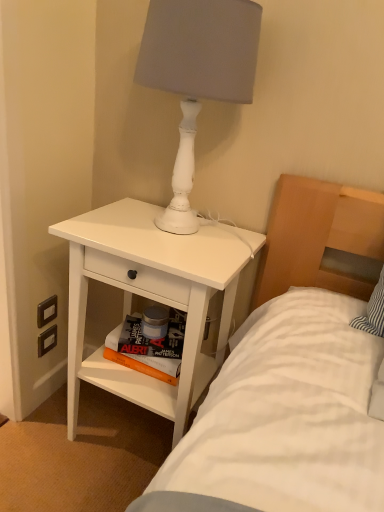
Identify the location of matte white switch at lower left, marked as the 2th electric outlet in a bottom-to-top arrangement. This screenshot has width=384, height=512. (46, 311).

Where is `black plastic electric outlet at lower left, the 1th electric outlet from the bottom`? black plastic electric outlet at lower left, the 1th electric outlet from the bottom is located at coordinates (47, 340).

Image resolution: width=384 pixels, height=512 pixels. In order to click on white matte nightstand at lower left in this screenshot , I will do (x=150, y=297).

In order to face orange matte book at lower center, the first magazine in the bottom-to-top sequence, should I rotate leftwards or rightwards?

You should rotate left by 6.099 degrees.

I want to click on matte white switch at lower left, the first electric outlet viewed from the top, so click(x=46, y=311).

Is hardcover book at lower center, which is counted as the first magazine, starting from the top, wider than matte white switch at lower left, marked as the 2th electric outlet in a bottom-to-top arrangement?

Correct, the width of hardcover book at lower center, which is counted as the first magazine, starting from the top, exceeds that of matte white switch at lower left, marked as the 2th electric outlet in a bottom-to-top arrangement.

Which electric outlet is the 1st one when counting from the left side of the hardcover book at lower center, which is counted as the first magazine, starting from the top? Please provide its 2D coordinates.

[(46, 311)]

Does point (154, 350) appear closer or farther from the camera than point (47, 308)?

Point (154, 350) is closer to the camera than point (47, 308).

This screenshot has height=512, width=384. I want to click on lamp above the orange matte book at lower center, the first magazine in the bottom-to-top sequence (from a real-world perspective), so click(x=197, y=74).

Who is bigger, orange matte book at lower center, the first magazine in the bottom-to-top sequence, or white matte lamp at upper right?

white matte lamp at upper right.

Is orange matte book at lower center, the first magazine in the bottom-to-top sequence, in front of or behind white matte lamp at upper right in the image?

orange matte book at lower center, the first magazine in the bottom-to-top sequence, is positioned farther from the viewer than white matte lamp at upper right.

Can white matte lamp at upper right be found inside orange matte book at lower center, the first magazine in the bottom-to-top sequence?

Actually, white matte lamp at upper right is outside orange matte book at lower center, the first magazine in the bottom-to-top sequence.

Is black plastic electric outlet at lower left, the second electric outlet positioned from the top, positioned beyond the bounds of orange matte book at lower center, which is the 2th magazine from top to bottom?

Yes, black plastic electric outlet at lower left, the second electric outlet positioned from the top, is outside of orange matte book at lower center, which is the 2th magazine from top to bottom.

Would you consider black plastic electric outlet at lower left, the second electric outlet positioned from the top, to be distant from orange matte book at lower center, the first magazine in the bottom-to-top sequence?

No, there isn't a large distance between black plastic electric outlet at lower left, the second electric outlet positioned from the top, and orange matte book at lower center, the first magazine in the bottom-to-top sequence.

Between black plastic electric outlet at lower left, the 1th electric outlet from the bottom, and orange matte book at lower center, the first magazine in the bottom-to-top sequence, which one appears on the left side from the viewer's perspective?

black plastic electric outlet at lower left, the 1th electric outlet from the bottom.

Find the location of a particular element. The width and height of the screenshot is (384, 512). electric outlet below the orange matte book at lower center, which is the 2th magazine from top to bottom (from a real-world perspective) is located at coordinates (47, 340).

Between white matte lamp at upper right and white matte nightstand at lower left, which one has larger size?

With larger size is white matte nightstand at lower left.

Considering the relative positions of white matte lamp at upper right and white matte nightstand at lower left in the image provided, is white matte lamp at upper right to the left or to the right of white matte nightstand at lower left?

In the image, white matte lamp at upper right appears on the right side of white matte nightstand at lower left.

Which is in front, white matte lamp at upper right or white matte nightstand at lower left?

white matte lamp at upper right.

Does white matte nightstand at lower left come behind orange matte book at lower center, the first magazine in the bottom-to-top sequence?

No.

Are white matte nightstand at lower left and orange matte book at lower center, the first magazine in the bottom-to-top sequence, located far from each other?

Actually, white matte nightstand at lower left and orange matte book at lower center, the first magazine in the bottom-to-top sequence, are a little close together.

Would you say white matte nightstand at lower left is to the left or to the right of orange matte book at lower center, which is the 2th magazine from top to bottom, in the picture?

From the image, it's evident that white matte nightstand at lower left is to the right of orange matte book at lower center, which is the 2th magazine from top to bottom.

Would you say white matte nightstand at lower left is outside orange matte book at lower center, which is the 2th magazine from top to bottom?

Absolutely, white matte nightstand at lower left is external to orange matte book at lower center, which is the 2th magazine from top to bottom.

Considering the relative sizes of hardcover book at lower center, which is counted as the first magazine, starting from the top, and black plastic electric outlet at lower left, the 1th electric outlet from the bottom, in the image provided, is hardcover book at lower center, which is counted as the first magazine, starting from the top, smaller than black plastic electric outlet at lower left, the 1th electric outlet from the bottom,?

No, hardcover book at lower center, which is counted as the first magazine, starting from the top, is not smaller than black plastic electric outlet at lower left, the 1th electric outlet from the bottom.

Would you say hardcover book at lower center, the 2th magazine positioned from the bottom, contains black plastic electric outlet at lower left, the 1th electric outlet from the bottom?

No, black plastic electric outlet at lower left, the 1th electric outlet from the bottom, is not surrounded by hardcover book at lower center, the 2th magazine positioned from the bottom.

From a real-world perspective, who is located lower, hardcover book at lower center, which is counted as the first magazine, starting from the top, or black plastic electric outlet at lower left, the 1th electric outlet from the bottom?

black plastic electric outlet at lower left, the 1th electric outlet from the bottom.

Is the surface of hardcover book at lower center, which is counted as the first magazine, starting from the top, in direct contact with black plastic electric outlet at lower left, the second electric outlet positioned from the top?

No, hardcover book at lower center, which is counted as the first magazine, starting from the top, is not touching black plastic electric outlet at lower left, the second electric outlet positioned from the top.

How different are the orientations of hardcover book at lower center, the 2th magazine positioned from the bottom, and white matte lamp at upper right in degrees?

hardcover book at lower center, the 2th magazine positioned from the bottom, and white matte lamp at upper right are facing 21.8 degrees away from each other.

Could you tell me if hardcover book at lower center, the 2th magazine positioned from the bottom, is turned towards white matte lamp at upper right?

No.

Considering the sizes of hardcover book at lower center, the 2th magazine positioned from the bottom, and white matte lamp at upper right in the image, is hardcover book at lower center, the 2th magazine positioned from the bottom, wider or thinner than white matte lamp at upper right?

In the image, hardcover book at lower center, the 2th magazine positioned from the bottom, appears to be more narrow than white matte lamp at upper right.

From the matte white switch at lower left, marked as the 2th electric outlet in a bottom-to-top arrangement, count 1st magazines forward and point to it. Please provide its 2D coordinates.

[(151, 340)]

Identify the location of the 1st magazine behind the white matte lamp at upper right, starting your count from the anchor. (142, 360).

Estimate the real-world distances between objects in this image. Which object is further from matte white switch at lower left, the first electric outlet viewed from the top, white matte lamp at upper right or orange matte book at lower center, which is the 2th magazine from top to bottom?

Result: white matte lamp at upper right lies further to matte white switch at lower left, the first electric outlet viewed from the top, than the other object.

Looking at the image, which one is located closer to hardcover book at lower center, which is counted as the first magazine, starting from the top, matte white switch at lower left, marked as the 2th electric outlet in a bottom-to-top arrangement, or black plastic electric outlet at lower left, the second electric outlet positioned from the top?

matte white switch at lower left, marked as the 2th electric outlet in a bottom-to-top arrangement, is positioned closer to the anchor hardcover book at lower center, which is counted as the first magazine, starting from the top.

Which object lies further to the anchor point white matte nightstand at lower left, white matte lamp at upper right or orange matte book at lower center, which is the 2th magazine from top to bottom?

white matte lamp at upper right lies further to white matte nightstand at lower left than the other object.

Based on their spatial positions, is black plastic electric outlet at lower left, the 1th electric outlet from the bottom, or orange matte book at lower center, which is the 2th magazine from top to bottom, further from white matte nightstand at lower left?

black plastic electric outlet at lower left, the 1th electric outlet from the bottom.

From the image, which object appears to be farther from hardcover book at lower center, the 2th magazine positioned from the bottom, black plastic electric outlet at lower left, the 1th electric outlet from the bottom, or white matte nightstand at lower left?

Among the two, black plastic electric outlet at lower left, the 1th electric outlet from the bottom, is located further to hardcover book at lower center, the 2th magazine positioned from the bottom.

Looking at the image, which one is located further to black plastic electric outlet at lower left, the second electric outlet positioned from the top, matte white switch at lower left, marked as the 2th electric outlet in a bottom-to-top arrangement, or white matte lamp at upper right?

The object further to black plastic electric outlet at lower left, the second electric outlet positioned from the top, is white matte lamp at upper right.

Which object lies nearer to the anchor point matte white switch at lower left, the first electric outlet viewed from the top, black plastic electric outlet at lower left, the second electric outlet positioned from the top, or hardcover book at lower center, the 2th magazine positioned from the bottom?

Among the two, black plastic electric outlet at lower left, the second electric outlet positioned from the top, is located nearer to matte white switch at lower left, the first electric outlet viewed from the top.

From the image, which object appears to be nearer to matte white switch at lower left, the first electric outlet viewed from the top, hardcover book at lower center, which is counted as the first magazine, starting from the top, or black plastic electric outlet at lower left, the second electric outlet positioned from the top?

The object closer to matte white switch at lower left, the first electric outlet viewed from the top, is black plastic electric outlet at lower left, the second electric outlet positioned from the top.

The height and width of the screenshot is (512, 384). Identify the location of electric outlet located between black plastic electric outlet at lower left, the 1th electric outlet from the bottom, and hardcover book at lower center, the 2th magazine positioned from the bottom, in the left-right direction. (46, 311).

The height and width of the screenshot is (512, 384). Find the location of `magazine between white matte lamp at upper right and orange matte book at lower center, which is the 2th magazine from top to bottom, in the up-down direction`. magazine between white matte lamp at upper right and orange matte book at lower center, which is the 2th magazine from top to bottom, in the up-down direction is located at coordinates (151, 340).

The width and height of the screenshot is (384, 512). I want to click on electric outlet that lies between white matte lamp at upper right and white matte nightstand at lower left from top to bottom, so click(46, 311).

Find the location of a particular element. The width and height of the screenshot is (384, 512). nightstand between white matte lamp at upper right and black plastic electric outlet at lower left, the 1th electric outlet from the bottom, from top to bottom is located at coordinates point(150,297).